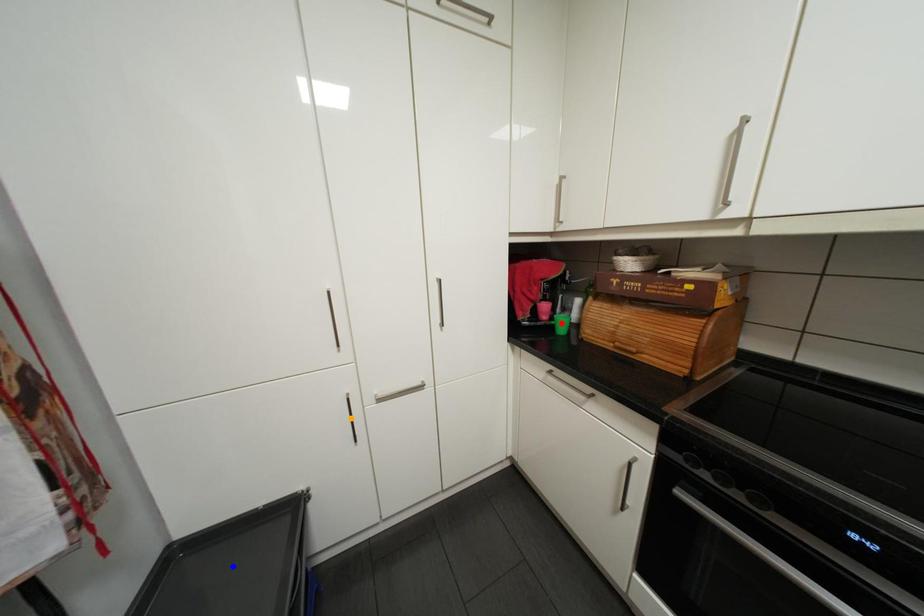
Order these from nearest to farthest:
- blue point
- red point
- orange point

red point, orange point, blue point